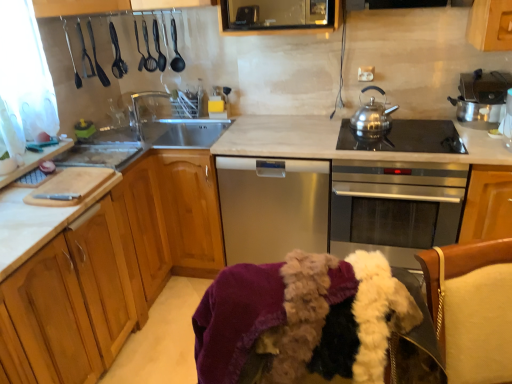
Question: Does stainless steel oven at center have a lesser height compared to stainless steel teapot at upper right?

Choices:
 (A) yes
 (B) no

Answer: (B)

Question: Does stainless steel oven at center have a lesser width compared to stainless steel teapot at upper right?

Choices:
 (A) yes
 (B) no

Answer: (B)

Question: Is stainless steel oven at center facing away from stainless steel teapot at upper right?

Choices:
 (A) yes
 (B) no

Answer: (B)

Question: Could you tell me if stainless steel oven at center is facing stainless steel teapot at upper right?

Choices:
 (A) yes
 (B) no

Answer: (B)

Question: From a real-world perspective, is stainless steel oven at center over stainless steel teapot at upper right?

Choices:
 (A) no
 (B) yes

Answer: (A)

Question: Is stainless steel oven at center bigger than stainless steel teapot at upper right?

Choices:
 (A) no
 (B) yes

Answer: (B)

Question: Is stainless steel oven at center beside white fabric swivel chair at lower right?

Choices:
 (A) yes
 (B) no

Answer: (B)

Question: Does stainless steel oven at center have a greater height compared to white fabric swivel chair at lower right?

Choices:
 (A) yes
 (B) no

Answer: (A)

Question: Can you confirm if stainless steel oven at center is shorter than white fabric swivel chair at lower right?

Choices:
 (A) yes
 (B) no

Answer: (B)

Question: Can white fabric swivel chair at lower right be found inside stainless steel oven at center?

Choices:
 (A) yes
 (B) no

Answer: (B)

Question: From a real-world perspective, is stainless steel oven at center located higher than white fabric swivel chair at lower right?

Choices:
 (A) no
 (B) yes

Answer: (A)

Question: Considering the relative sizes of stainless steel oven at center and white fabric swivel chair at lower right in the image provided, is stainless steel oven at center thinner than white fabric swivel chair at lower right?

Choices:
 (A) no
 (B) yes

Answer: (A)

Question: Does satin silver dishwasher at center have a greater height compared to shiny metallic pot at upper right, arranged as the first appliance when viewed from the right?

Choices:
 (A) no
 (B) yes

Answer: (B)